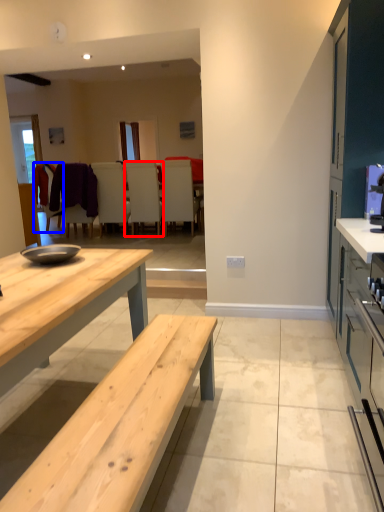
Question: Among these objects, which one is nearest to the camera, chair (highlighted by a red box) or chair (highlighted by a blue box)?

Choices:
 (A) chair
 (B) chair

Answer: (A)